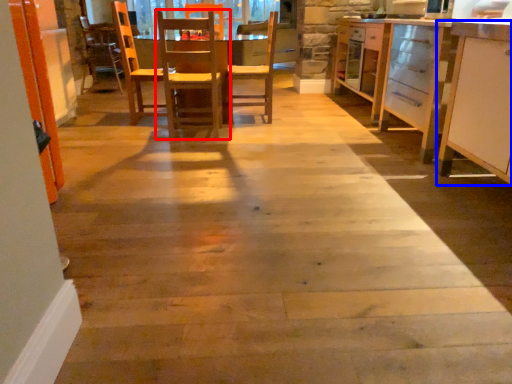
Question: Which of the following is the closest to the observer, chair (highlighted by a red box) or cabinetry (highlighted by a blue box)?

Choices:
 (A) chair
 (B) cabinetry

Answer: (B)